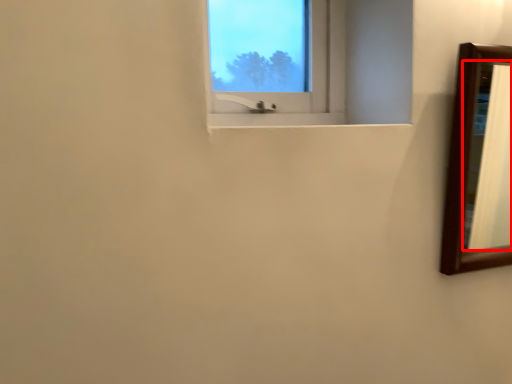
Question: From the image's perspective, where is mirror (annotated by the red box) located in relation to window screen in the image?

Choices:
 (A) above
 (B) below

Answer: (B)